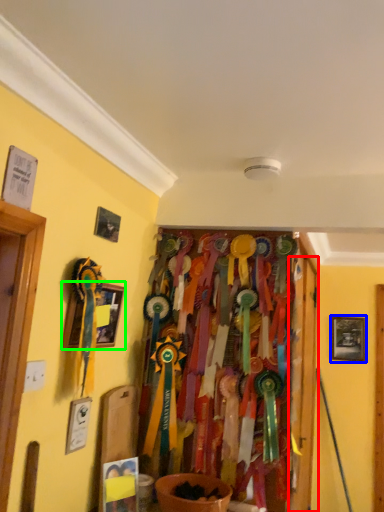
Question: Considering the real-world distances, which object is farthest from door (highlighted by a red box)? picture frame (highlighted by a blue box) or picture frame (highlighted by a green box)?

Choices:
 (A) picture frame
 (B) picture frame

Answer: (A)